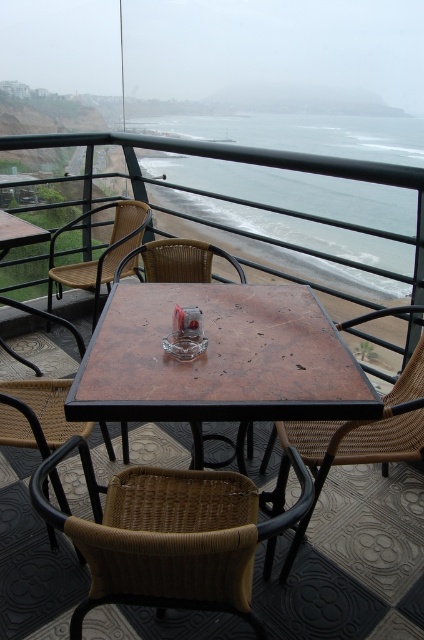
You are standing at the center of the outdoor seating area and want to move to the woven wicker chair at center located at point [357,438]. Is there a clear path to reach it without obstacles?

The woven wicker chair at center is located at point [357,438], and since the chairs are arranged neatly around the table, there should be a clear path to reach it without obstacles.

You are sitting on the woven wood chair at center and want to look at the clear water at center. In which direction should you turn your head?

The clear water at center is positioned on the right side of the woven wood chair at center, so you should turn your head to the right to look at the clear water at center.